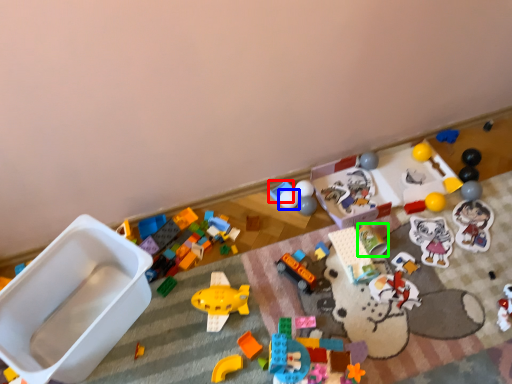
Question: Estimate the real-world distances between objects in this image. Which object is farther from toy (highlighted by a red box), toy (highlighted by a blue box) or toy (highlighted by a green box)?

Choices:
 (A) toy
 (B) toy

Answer: (B)